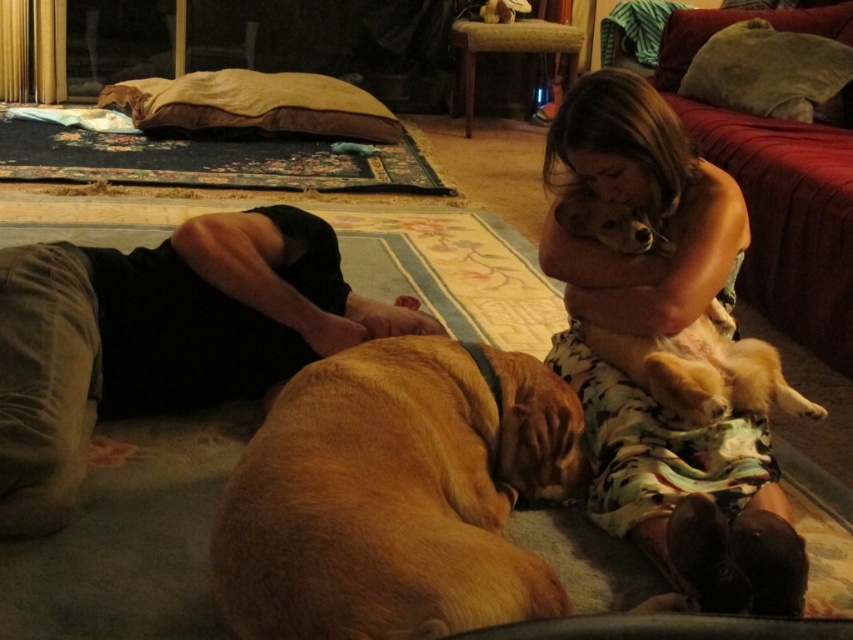
Which of these two, golden fur dog at center or light brown fur at upper right, stands taller?

light brown fur at upper right is taller.

Between golden fur dog at center and light brown fur at upper right, which one is positioned lower?

golden fur dog at center is below.

Is point (438, 442) closer to camera compared to point (556, 209)?

Yes, point (438, 442) is in front of point (556, 209).

At what (x,y) coordinates should I click in order to perform the action: click on golden fur dog at center. Please return your answer as a coordinate pair (x, y). Looking at the image, I should click on (396, 493).

Based on the photo, is golden fur dog at center to the right of fluffy brown dog at upper right from the viewer's perspective?

In fact, golden fur dog at center is to the left of fluffy brown dog at upper right.

Between golden fur dog at center and fluffy brown dog at upper right, which one appears on the left side from the viewer's perspective?

golden fur dog at center is more to the left.

Does point (434, 563) lie behind point (646, 188)?

That is False.

Where is `golden fur dog at center`? The image size is (853, 640). golden fur dog at center is located at coordinates (396, 493).

What do you see at coordinates (160, 337) in the screenshot?
I see `dark brown cotton pants at lower left` at bounding box center [160, 337].

Can you confirm if dark brown cotton pants at lower left is bigger than light brown fur at upper right?

Indeed, dark brown cotton pants at lower left has a larger size compared to light brown fur at upper right.

Where is `dark brown cotton pants at lower left`? dark brown cotton pants at lower left is located at coordinates (160, 337).

Find the location of a particular element. This screenshot has width=853, height=640. dark brown cotton pants at lower left is located at coordinates (160, 337).